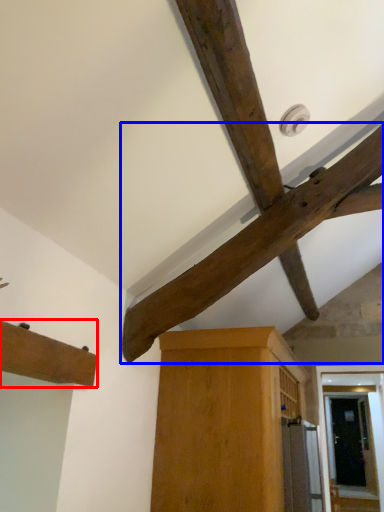
Question: Which object is further to the camera taking this photo, cabinetry (highlighted by a red box) or beam (highlighted by a blue box)?

Choices:
 (A) cabinetry
 (B) beam

Answer: (B)